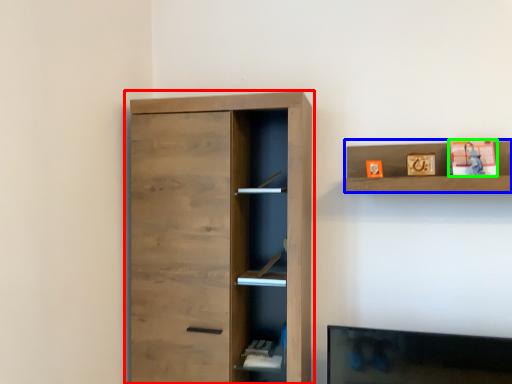
Question: Which object is positioned farthest from cupboard (highlighted by a red box)? Select from shelf (highlighted by a blue box) and toy (highlighted by a green box).

Choices:
 (A) shelf
 (B) toy

Answer: (B)